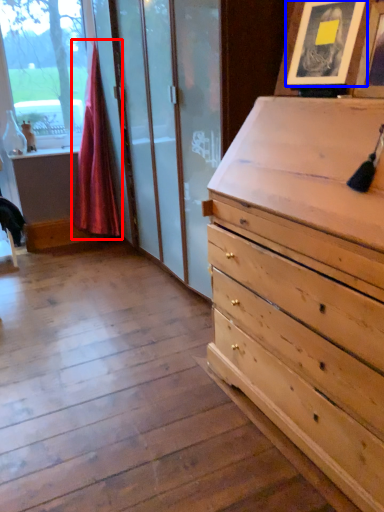
Question: Which point is further to the camera, curtain (highlighted by a red box) or picture frame (highlighted by a blue box)?

Choices:
 (A) curtain
 (B) picture frame

Answer: (A)